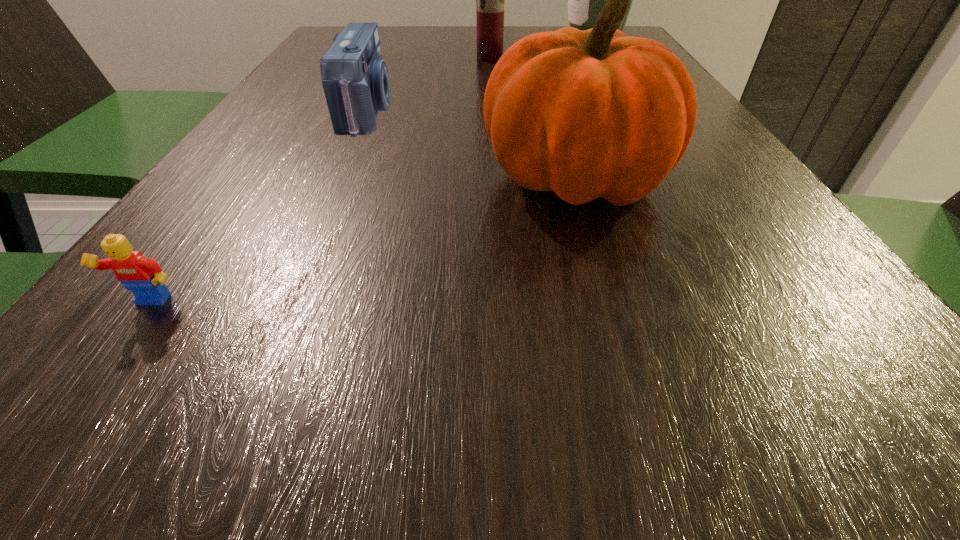
Where is `the farther liquor`? This screenshot has width=960, height=540. the farther liquor is located at coordinates (585, 0).

Where is `the farthest object`? the farthest object is located at coordinates (585, 0).

I want to click on the fourth nearest object, so click(x=490, y=0).

What are the coordinates of `the left liquor` in the screenshot? It's located at (490, 0).

This screenshot has width=960, height=540. In order to click on the third shortest object in this screenshot , I will do `click(586, 114)`.

I want to click on the second shortest object, so click(355, 79).

Locate an element on the screen. The height and width of the screenshot is (540, 960). the fourth object from right to left is located at coordinates (355, 79).

Locate an element on the screen. the nearest object is located at coordinates (142, 276).

Where is `the shortest object`? Image resolution: width=960 pixels, height=540 pixels. the shortest object is located at coordinates (142, 276).

At what (x,y) coordinates should I click in order to perform the action: click on blank area located 0.070m on the front-facing side of the farther liquor. Please return your answer as a coordinate pair (x, y). The width and height of the screenshot is (960, 540). Looking at the image, I should click on (537, 42).